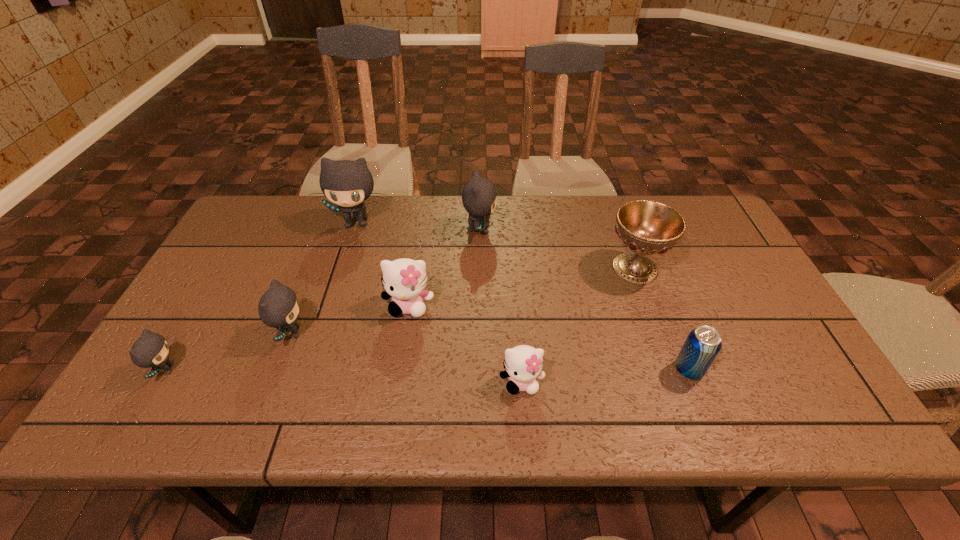
The image size is (960, 540). What are the coordinates of `the leftmost object` in the screenshot? It's located at (151, 350).

In order to click on the leftmost gray kitten in this screenshot , I will do `click(151, 350)`.

Find the location of a particular element. vacant position located on the front-facing side of the biggest gray kitten is located at coordinates 348,250.

Identify the location of vacant space located 0.190m on the front-facing side of the rightmost gray kitten. (558, 230).

The width and height of the screenshot is (960, 540). I want to click on vacant area situated 0.330m on the left of the red chalice, so click(x=488, y=268).

I want to click on vacant area located 0.110m on the front-facing side of the farther white kitten, so click(401, 357).

I want to click on free space located on the front-facing side of the second smallest gray kitten, so click(381, 333).

Find the location of a particular element. This screenshot has height=540, width=960. free region located 0.140m on the right of the blue beer can is located at coordinates (764, 369).

Identify the location of free spot located 0.070m on the front-facing side of the smaller white kitten. This screenshot has height=540, width=960. (525, 428).

Where is `free space located 0.090m on the front-facing side of the leftmost object`? This screenshot has width=960, height=540. free space located 0.090m on the front-facing side of the leftmost object is located at coordinates (219, 369).